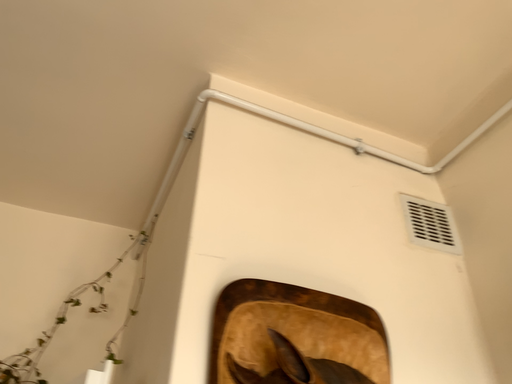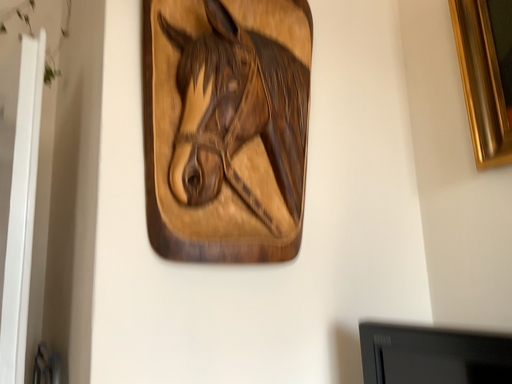
Question: How did the camera likely rotate when shooting the video?

Choices:
 (A) rotated right
 (B) rotated left

Answer: (A)